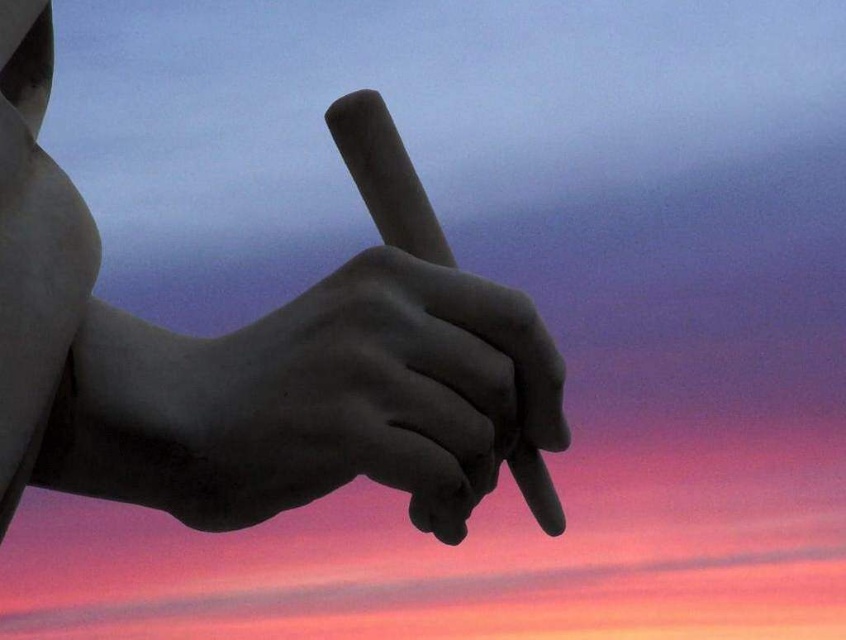
You are an artist trying to draw the scene with the matte gray pencil at center and the matte black hand at center. If your drawing area is 1 inch wide, will the pencil and hand fit side by side without overlapping?

The matte gray pencil at center is 1.18 inches away from the matte black hand at center. Since the distance between them is greater than 1 inch, they cannot fit side by side within a 1 inch wide drawing area without overlapping.

You are an artist trying to sketch the scene. You notice the matte gray pencil at center and the matte black hand at center. Which object is positioned to the right side of the other?

The matte gray pencil at center is to the left of the matte black hand at center, so the matte black hand at center is positioned to the right of the matte gray pencil at center.

You are an artist analyzing a sculpture of a hand holding a stick. You notice two points on the sculpture labeled as point (253, 365) and point (465, 486). Which point is closer to you?

Point (253, 365) is further to the viewer than point (465, 486), so the point closer to you is point (465, 486).